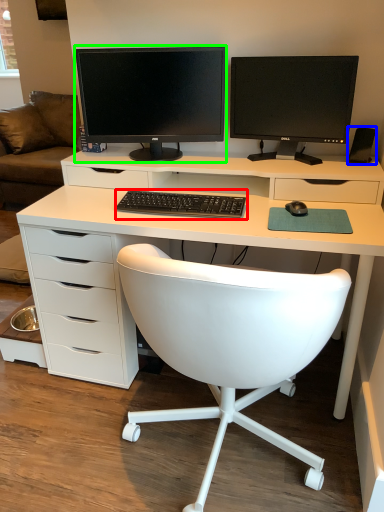
Question: Which is nearer to the computer keyboard (highlighted by a red box)? speaker (highlighted by a blue box) or computer monitor (highlighted by a green box).

Choices:
 (A) speaker
 (B) computer monitor

Answer: (B)